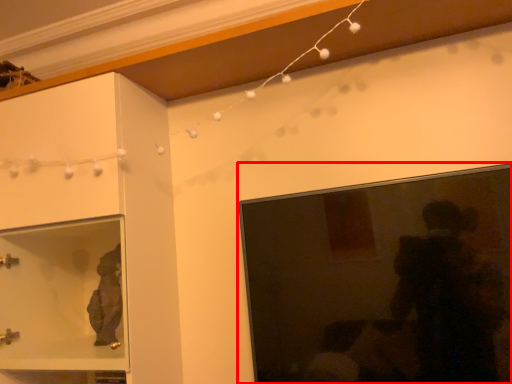
Question: Where is picture frame (annotated by the red box) located in relation to cabinetry in the image?

Choices:
 (A) left
 (B) right

Answer: (B)